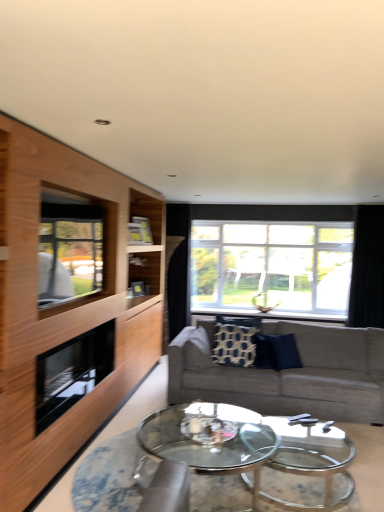
Question: Is wooden cabinet at left next to clear glass window at center, the second window when ordered from front to back, and touching it?

Choices:
 (A) no
 (B) yes

Answer: (A)

Question: Considering the relative positions of wooden cabinet at left and clear glass window at center, the second window when ordered from front to back, in the image provided, is wooden cabinet at left to the left of clear glass window at center, the second window when ordered from front to back, from the viewer's perspective?

Choices:
 (A) no
 (B) yes

Answer: (B)

Question: Is wooden cabinet at left not within clear glass window at center, the second window when ordered from front to back?

Choices:
 (A) yes
 (B) no

Answer: (A)

Question: From the image's perspective, is wooden cabinet at left on top of clear glass window at center, the second window when ordered from front to back?

Choices:
 (A) no
 (B) yes

Answer: (A)

Question: Could clear glass window at center, which ranks as the first window in right-to-left order, be considered to be inside wooden cabinet at left?

Choices:
 (A) no
 (B) yes

Answer: (A)

Question: Considering the relative sizes of wooden cabinet at left and clear glass window at center, the second window when ordered from front to back, in the image provided, is wooden cabinet at left thinner than clear glass window at center, the second window when ordered from front to back,?

Choices:
 (A) yes
 (B) no

Answer: (B)

Question: Is black glass fireplace at left aimed at textured gray couch at center?

Choices:
 (A) yes
 (B) no

Answer: (B)

Question: Is black glass fireplace at left not inside textured gray couch at center?

Choices:
 (A) yes
 (B) no

Answer: (A)

Question: Is black glass fireplace at left turned away from textured gray couch at center?

Choices:
 (A) yes
 (B) no

Answer: (B)

Question: Is black glass fireplace at left wider than textured gray couch at center?

Choices:
 (A) yes
 (B) no

Answer: (B)

Question: Is black glass fireplace at left bigger than textured gray couch at center?

Choices:
 (A) no
 (B) yes

Answer: (A)

Question: Considering the relative positions of black glass fireplace at left and textured gray couch at center in the image provided, is black glass fireplace at left to the right of textured gray couch at center from the viewer's perspective?

Choices:
 (A) no
 (B) yes

Answer: (A)

Question: Are clear glass window at center, the second window when ordered from front to back, and clear glass window at left, which is the 2th window from right to left, far apart?

Choices:
 (A) yes
 (B) no

Answer: (A)